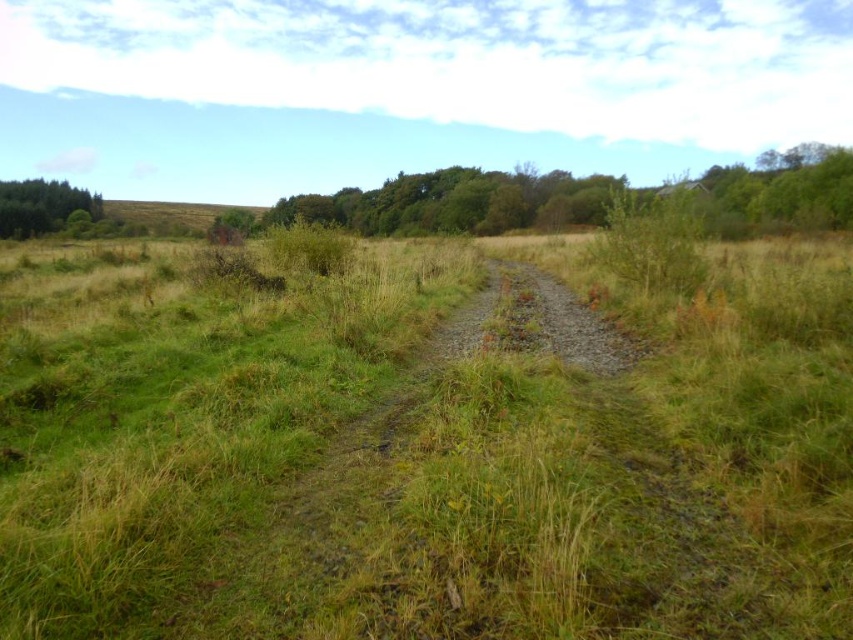
You are a hiker standing at the start of the path and want to reach the forest area behind the green leafy trees at left. Which direction should you walk relative to the green grassy at center?

You should walk towards the green leafy trees at left, which are located above the green grassy at center in the image. Since the forest area is behind the trees, moving in that direction will lead you towards the forest.

You are standing at the start of the path in the rural landscape. You see the green grassy at center and the green leafy trees at left. Which one is nearer to you?

The green grassy at center is closer to the viewer than the green leafy trees at left, so the green grassy at center is nearer to you.